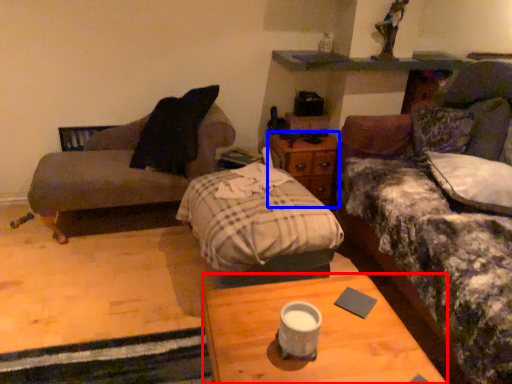
Question: Which point is closer to the camera, desk (highlighted by a red box) or nightstand (highlighted by a blue box)?

Choices:
 (A) desk
 (B) nightstand

Answer: (A)